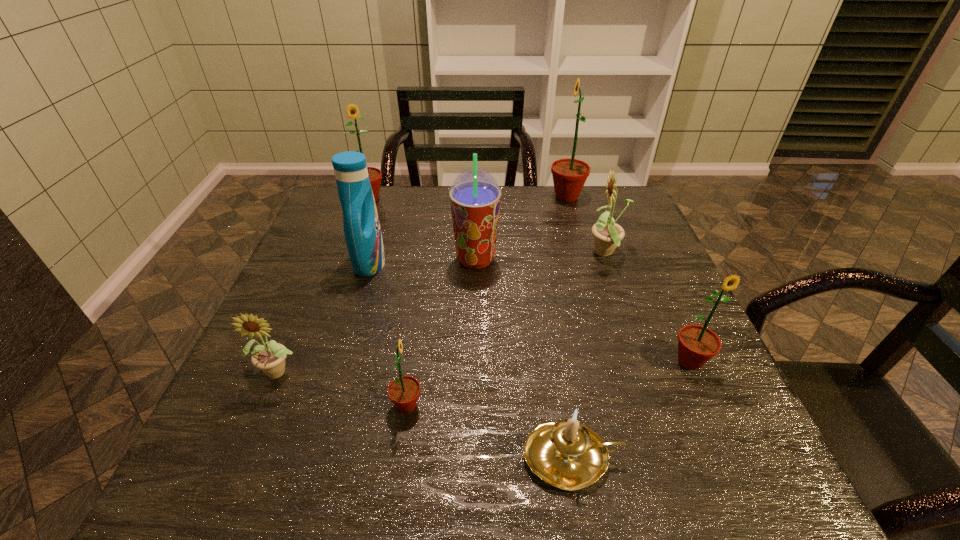
Locate an element on the screen. Image resolution: width=960 pixels, height=540 pixels. vacant space located 0.300m on the back of the smoothie is located at coordinates (476, 189).

At what (x,y) coordinates should I click in order to perform the action: click on blank area located on the front-facing side of the detergent. Please return your answer as a coordinate pair (x, y). This screenshot has width=960, height=540. Looking at the image, I should click on (439, 263).

Where is `free space located on the front-facing side of the third farthest sunflower`? The height and width of the screenshot is (540, 960). free space located on the front-facing side of the third farthest sunflower is located at coordinates (460, 254).

Where is `vacant space located 0.220m on the front-facing side of the third farthest sunflower`? This screenshot has height=540, width=960. vacant space located 0.220m on the front-facing side of the third farthest sunflower is located at coordinates (x=501, y=254).

In order to click on vacant space situated on the front-facing side of the third farthest sunflower in this screenshot , I will do `click(520, 254)`.

At what (x,y) coordinates should I click in order to perform the action: click on vacant space located on the face of the second nearest green sunflower. Please return your answer as a coordinate pair (x, y). Looking at the image, I should click on (x=739, y=472).

Identify the location of vacant space situated on the front-facing side of the smaller yellow sunflower. (255, 431).

Image resolution: width=960 pixels, height=540 pixels. In order to click on free location located 0.340m on the face of the sixth object from right to left in this screenshot , I will do `click(605, 405)`.

Find the location of a particular element. The width and height of the screenshot is (960, 540). free space located 0.180m on the handle side of the shortest object is located at coordinates (727, 457).

The width and height of the screenshot is (960, 540). What are the coordinates of `object present at the near edge` in the screenshot? It's located at (568, 455).